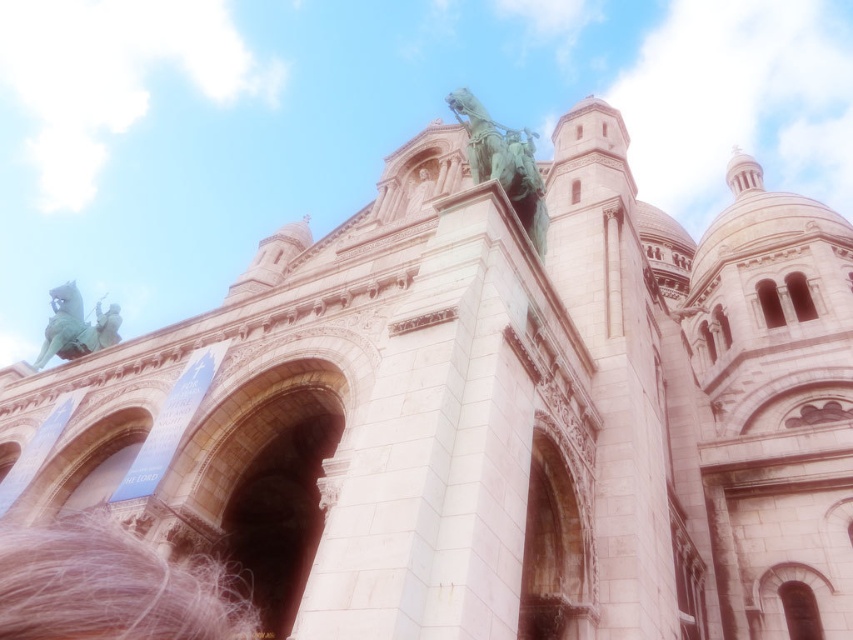
Can you confirm if pink hair at lower left is positioned to the left of green patina metal statue at upper center?

Indeed, pink hair at lower left is positioned on the left side of green patina metal statue at upper center.

Between point (199, 577) and point (445, 102), which one is positioned behind?

The point (445, 102) is behind.

Who is more distant from viewer, (91,545) or (473,109)?

Point (473,109)

Locate an element on the screen. This screenshot has width=853, height=640. pink hair at lower left is located at coordinates pos(111,586).

Is green patina metal statue at upper center smaller than green patina statue at upper center?

Incorrect, green patina metal statue at upper center is not smaller in size than green patina statue at upper center.

Does point (521, 147) come farther from viewer compared to point (45, 339)?

No, (521, 147) is in front of (45, 339).

Which is in front, point (515, 179) or point (70, 307)?

Point (515, 179)

Where is `green patina metal statue at upper center`? The width and height of the screenshot is (853, 640). green patina metal statue at upper center is located at coordinates (503, 163).

Does pink hair at lower left appear over green patina statue at upper center?

No.

Is pink hair at lower left to the right of green patina statue at upper center from the viewer's perspective?

Indeed, pink hair at lower left is positioned on the right side of green patina statue at upper center.

Who is more distant from viewer, (18, 557) or (47, 321)?

Point (47, 321)

At what (x,y) coordinates should I click in order to perform the action: click on pink hair at lower left. Please return your answer as a coordinate pair (x, y). The width and height of the screenshot is (853, 640). Looking at the image, I should click on (111, 586).